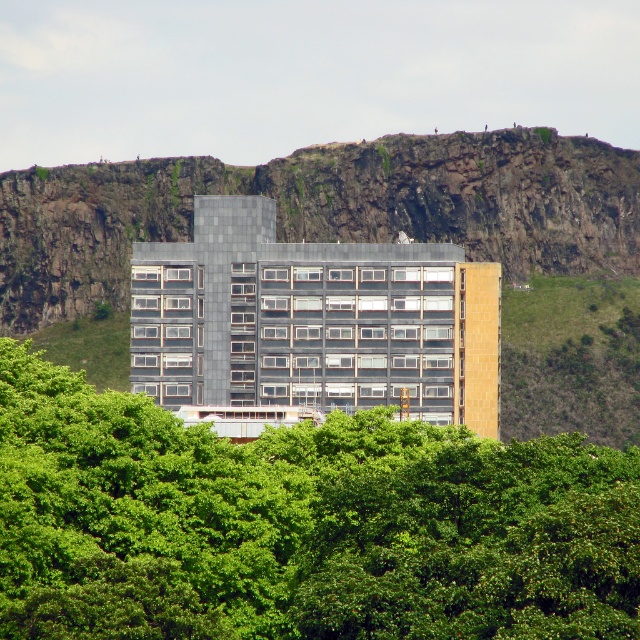
Question: Does green leafy tree at center appear on the left side of rugged rock at center?

Choices:
 (A) yes
 (B) no

Answer: (B)

Question: Is green leafy tree at center to the right of rugged rock at center from the viewer's perspective?

Choices:
 (A) no
 (B) yes

Answer: (B)

Question: Which point is closer to the camera?

Choices:
 (A) rugged rock at center
 (B) green leafy tree at center
 (C) matte glass building at center

Answer: (B)

Question: Which object is the closest to the rugged rock at center?

Choices:
 (A) green leafy tree at center
 (B) matte glass building at center

Answer: (B)

Question: Which of these objects is positioned closest to the green leafy tree at center?

Choices:
 (A) rugged rock at center
 (B) matte glass building at center

Answer: (B)

Question: Can you confirm if green leafy tree at center is positioned above matte glass building at center?

Choices:
 (A) yes
 (B) no

Answer: (B)